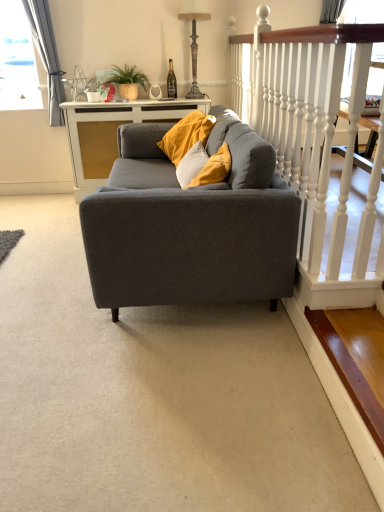
Describe the element at coordinates (349, 375) in the screenshot. This screenshot has width=384, height=512. I see `wooden stair at lower right` at that location.

Identify the location of matte gray couch at center. (188, 229).

The image size is (384, 512). I want to click on wooden stair at lower right, so click(x=349, y=375).

Identify the location of rail above the matte gray couch at center (from a real-world perspective). The width and height of the screenshot is (384, 512). (313, 139).

Can you confirm if matte gray couch at center is wider than white wooden railing at upper right?

Correct, the width of matte gray couch at center exceeds that of white wooden railing at upper right.

In the image, is matte gray couch at center on the left side or the right side of white wooden railing at upper right?

In the image, matte gray couch at center appears on the left side of white wooden railing at upper right.

Which of these two, gray fabric curtain at upper left or antique bronze lamp at upper center, is bigger?

With larger size is gray fabric curtain at upper left.

Is gray fabric curtain at upper left turned away from antique bronze lamp at upper center?

That's not correct — gray fabric curtain at upper left is not looking away from antique bronze lamp at upper center.

Between gray fabric curtain at upper left and antique bronze lamp at upper center, which one has larger width?

With larger width is gray fabric curtain at upper left.

Is antique bronze lamp at upper center oriented towards gray fabric curtain at upper left?

No, antique bronze lamp at upper center is not turned towards gray fabric curtain at upper left.

Is antique bronze lamp at upper center inside the boundaries of gray fabric curtain at upper left, or outside?

antique bronze lamp at upper center cannot be found inside gray fabric curtain at upper left.

Is antique bronze lamp at upper center behind gray fabric curtain at upper left?

Yes, antique bronze lamp at upper center is further from the viewer.

In the image, is antique bronze lamp at upper center positioned in front of or behind white wooden railing at upper right?

In the image, antique bronze lamp at upper center appears behind white wooden railing at upper right.

Is antique bronze lamp at upper center facing towards white wooden railing at upper right?

Yes, antique bronze lamp at upper center is facing white wooden railing at upper right.

Is there a large distance between antique bronze lamp at upper center and white wooden railing at upper right?

antique bronze lamp at upper center is positioned a significant distance from white wooden railing at upper right.

How different are the orientations of antique bronze lamp at upper center and white wooden railing at upper right in degrees?

89.1 degrees separate the facing orientations of antique bronze lamp at upper center and white wooden railing at upper right.

Is white wooden railing at upper right spatially inside matte gray couch at center, or outside of it?

white wooden railing at upper right is outside matte gray couch at center.

Considering the points (362, 253) and (186, 259), which point is behind, point (362, 253) or point (186, 259)?

Positioned behind is point (186, 259).

Is the depth of white wooden railing at upper right greater than that of matte gray couch at center?

No.

Would you consider white glossy cabinet at center to be distant from matte gray couch at center?

white glossy cabinet at center is positioned a significant distance from matte gray couch at center.

What's the angular difference between white glossy cabinet at center and matte gray couch at center's facing directions?

white glossy cabinet at center and matte gray couch at center are facing 90 degrees away from each other.

Based on their positions, is white glossy cabinet at center located to the left or right of matte gray couch at center?

From the image, it's evident that white glossy cabinet at center is to the left of matte gray couch at center.

Is point (114, 156) positioned before point (106, 246)?

No, it is not.

Is point (158, 103) positioned in front of point (335, 368)?

No, (158, 103) is behind (335, 368).

This screenshot has width=384, height=512. What are the coordinates of `table lying above the wooden stair at lower right (from the image's perspective)` in the screenshot? It's located at (113, 133).

How different are the orientations of white glossy cabinet at center and wooden stair at lower right in degrees?

white glossy cabinet at center and wooden stair at lower right are facing 90.4 degrees away from each other.

Based on their sizes in the image, would you say white glossy cabinet at center is bigger or smaller than wooden stair at lower right?

white glossy cabinet at center is bigger than wooden stair at lower right.

This screenshot has height=512, width=384. I want to click on studio couch lying below the white wooden railing at upper right (from the image's perspective), so click(188, 229).

Where is `curtain that is in front of the antique bronze lamp at upper center`? curtain that is in front of the antique bronze lamp at upper center is located at coordinates point(47,55).

Looking at the image, which one is located further to gray fabric curtain at upper left, matte gray couch at center or antique bronze lamp at upper center?

matte gray couch at center lies further to gray fabric curtain at upper left than the other object.

Considering their positions, is antique bronze lamp at upper center positioned further to white wooden railing at upper right than gray fabric curtain at upper left?

The object further to white wooden railing at upper right is gray fabric curtain at upper left.

From the image, which object appears to be farther from matte gray couch at center, white glossy cabinet at center or gray fabric curtain at upper left?

gray fabric curtain at upper left is further to matte gray couch at center.

From the image, which object appears to be farther from white glossy cabinet at center, gray fabric curtain at upper left or wooden stair at lower right?

wooden stair at lower right is positioned further to the anchor white glossy cabinet at center.

From the image, which object appears to be farther from antique bronze lamp at upper center, matte gray couch at center or gray fabric curtain at upper left?

matte gray couch at center lies further to antique bronze lamp at upper center than the other object.

Estimate the real-world distances between objects in this image. Which object is closer to matte gray couch at center, wooden stair at lower right or white glossy cabinet at center?

wooden stair at lower right.

Consider the image. From the image, which object appears to be farther from wooden stair at lower right, antique bronze lamp at upper center or gray fabric curtain at upper left?

gray fabric curtain at upper left is further to wooden stair at lower right.

Looking at the image, which one is located further to white glossy cabinet at center, matte gray couch at center or antique bronze lamp at upper center?

matte gray couch at center.

The image size is (384, 512). Identify the location of rail between wooden stair at lower right and gray fabric curtain at upper left along the z-axis. (313, 139).

You are a GUI agent. You are given a task and a screenshot of the screen. Output one action in this format:
    pyautogui.click(x=<x>, y=<y>)
    Task: Click on the studio couch located between white wooden railing at upper right and gray fabric curtain at upper left in the depth direction
    
    Given the screenshot: What is the action you would take?
    pyautogui.click(x=188, y=229)

Find the location of a particular element. This screenshot has height=512, width=384. rail located between wooden stair at lower right and white glossy cabinet at center in the depth direction is located at coordinates tap(313, 139).

Find the location of a particular element. The image size is (384, 512). curtain between white wooden railing at upper right and white glossy cabinet at center from front to back is located at coordinates (47, 55).